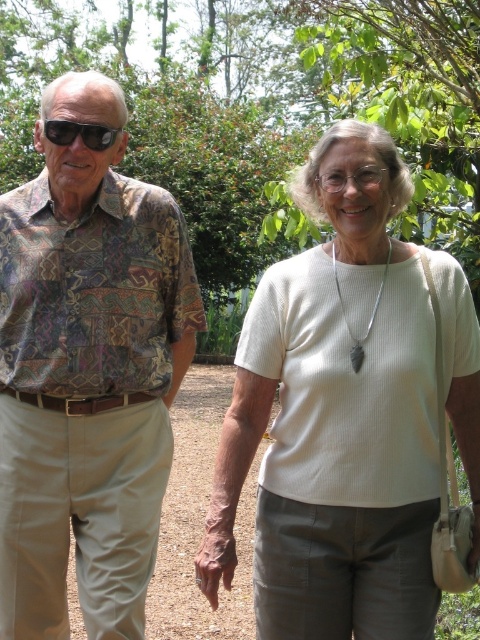
Question: Among these points, which one is farthest from the camera?

Choices:
 (A) (404, 566)
 (B) (49, 576)

Answer: (B)

Question: Is white ribbed shirt at center bigger than black plastic sunglasses at left?

Choices:
 (A) yes
 (B) no

Answer: (A)

Question: Which point is farther from the camera taking this photo?

Choices:
 (A) (267, 275)
 (B) (72, 330)

Answer: (B)

Question: Is printed fabric shirt at left to the right of black plastic sunglasses at left from the viewer's perspective?

Choices:
 (A) yes
 (B) no

Answer: (A)

Question: Does white ribbed shirt at center have a larger size compared to black plastic sunglasses at left?

Choices:
 (A) yes
 (B) no

Answer: (A)

Question: Estimate the real-world distances between objects in this image. Which object is farther from the printed fabric shirt at left?

Choices:
 (A) black plastic sunglasses at left
 (B) white ribbed shirt at center

Answer: (B)